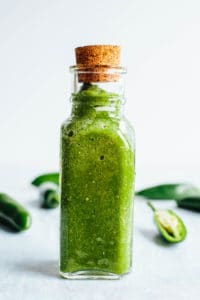
Identify the location of cork. This screenshot has height=300, width=200. (97, 54).